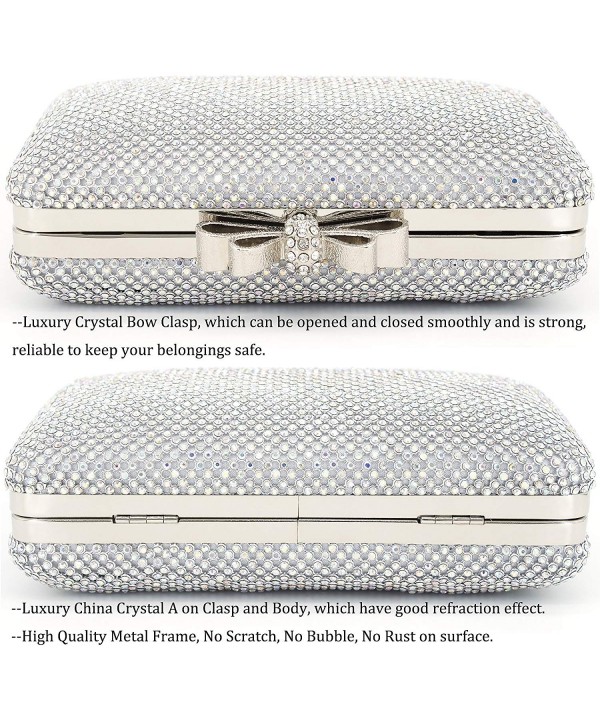
Locate an element on the screen. This screenshot has height=720, width=600. back of jeweled box is located at coordinates (275, 528).